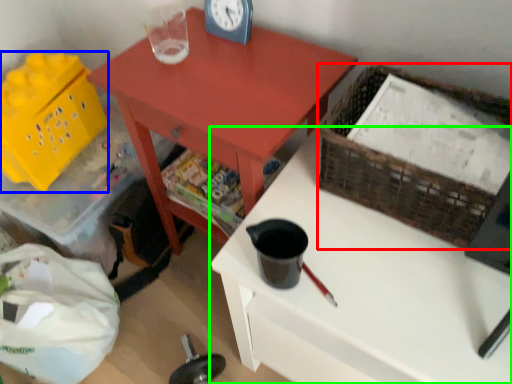
Question: Which object is the farthest from basket (highlighted by a red box)? Choose among these: basket (highlighted by a blue box) or desk (highlighted by a green box).

Choices:
 (A) basket
 (B) desk

Answer: (A)